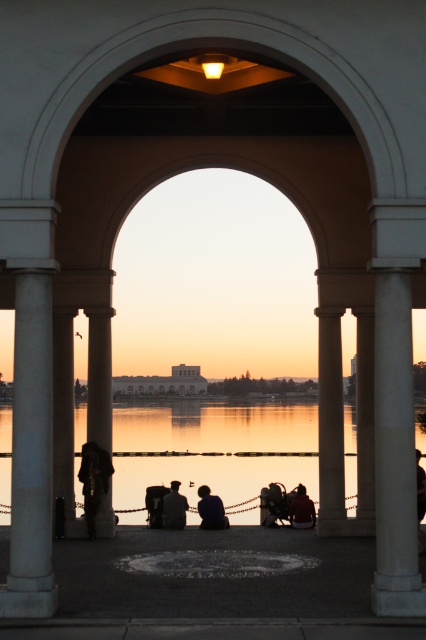
Can you confirm if matte black jacket at lower center is positioned below silhouette human at center?

Correct, matte black jacket at lower center is located below silhouette human at center.

Does matte black jacket at lower center lie behind silhouette human at center?

Yes, it is.

This screenshot has width=426, height=640. What do you see at coordinates (302, 509) in the screenshot?
I see `matte black jacket at lower center` at bounding box center [302, 509].

In order to click on matte black jacket at lower center in this screenshot , I will do `click(302, 509)`.

Based on the photo, which is below, dark gray fabric jacket at center or matte black jacket at lower center?

matte black jacket at lower center

Does dark gray fabric jacket at center have a lesser height compared to matte black jacket at lower center?

Incorrect, dark gray fabric jacket at center's height does not fall short of matte black jacket at lower center's.

Between point (172, 524) and point (305, 496), which one is positioned in front?

Point (172, 524)

Locate an element on the screen. The width and height of the screenshot is (426, 640). dark gray fabric jacket at center is located at coordinates (173, 508).

Which is behind, point (271, 502) or point (423, 548)?

Positioned behind is point (271, 502).

Does matte black jacket at center appear on the right side of silhouette human at center?

Incorrect, matte black jacket at center is not on the right side of silhouette human at center.

Image resolution: width=426 pixels, height=640 pixels. I want to click on matte black jacket at center, so click(273, 504).